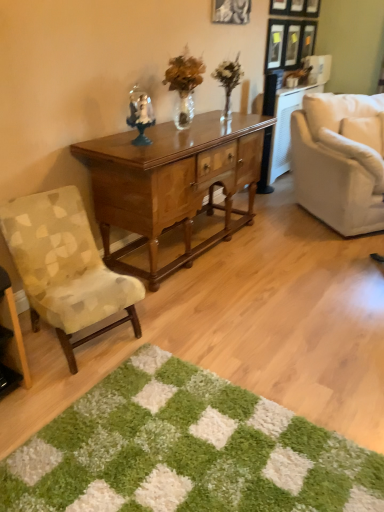
The width and height of the screenshot is (384, 512). I want to click on empty space that is ontop of polished wood desk at center (from a real-world perspective), so click(175, 136).